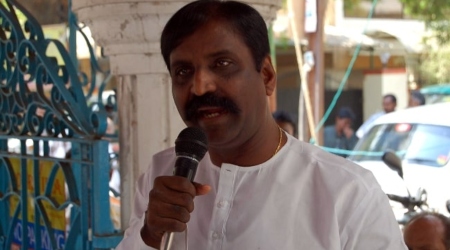
You are a GUI agent. You are given a task and a screenshot of the screen. Output one action in this format:
    pyautogui.click(x=<x>, y=<y>)
    Task: Click on the white column
    This screenshot has width=450, height=250.
    Given the screenshot: What is the action you would take?
    pyautogui.click(x=152, y=121), pyautogui.click(x=146, y=37)